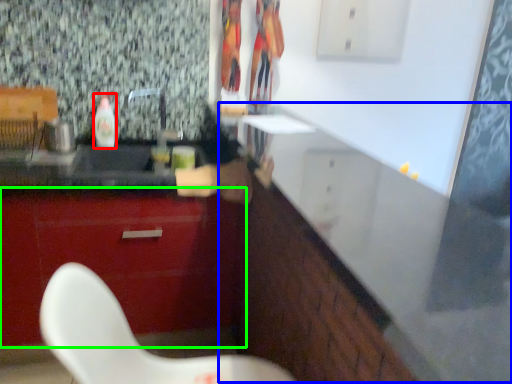
Question: Based on their relative distances, which object is nearer to bottle (highlighted by a red box)? Choose from counter (highlighted by a blue box) and cabinetry (highlighted by a green box).

Choices:
 (A) counter
 (B) cabinetry

Answer: (B)